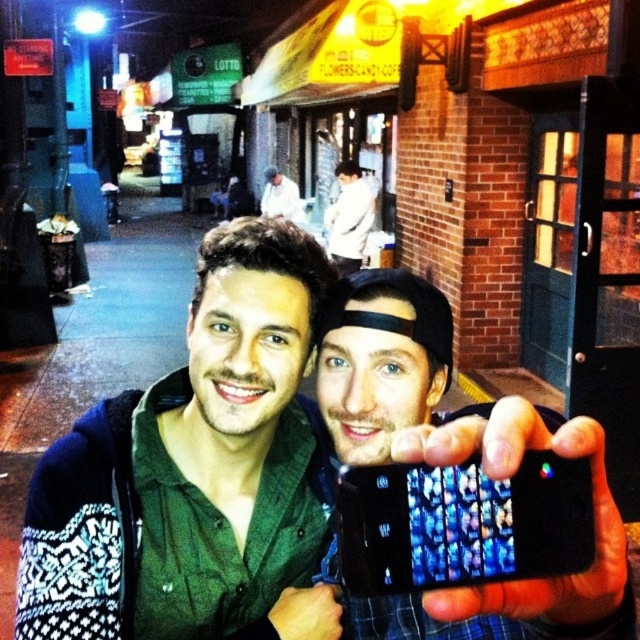
You are a photographer trying to capture both the green matte shirt at center and the white cotton shirt at center in a single frame. Which shirt should you adjust your camera angle to focus on first if you want to ensure both are fully visible?

The green matte shirt at center has a lesser width compared to the white cotton shirt at center, so you should focus on the wider white cotton shirt at center first to ensure it fits within the frame, then adjust to include the narrower green matte shirt at center.